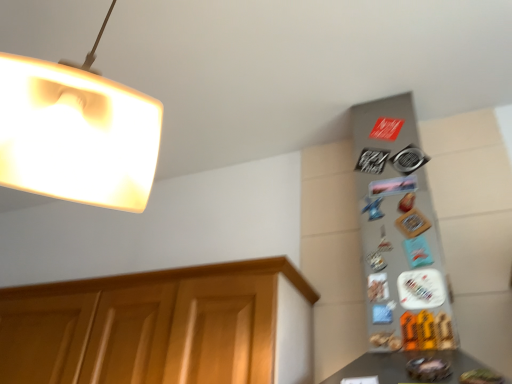
Where is `matte white lampshade at upper left`? matte white lampshade at upper left is located at coordinates (76, 133).

Measure the distance between matte white lampshade at upper left and camera.

The depth of matte white lampshade at upper left is 22.44 inches.

The width and height of the screenshot is (512, 384). Describe the element at coordinates (76, 133) in the screenshot. I see `matte white lampshade at upper left` at that location.

Find the location of a particular element. matte white lampshade at upper left is located at coordinates (76, 133).